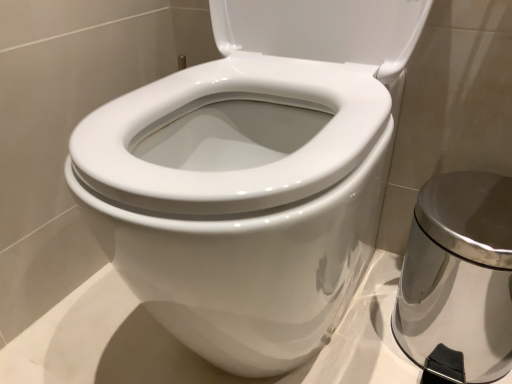
Question: Based on their sizes in the image, would you say white glossy bidet at center is bigger or smaller than satin silver trash can at right?

Choices:
 (A) big
 (B) small

Answer: (A)

Question: Is white glossy bidet at center wider or thinner than satin silver trash can at right?

Choices:
 (A) wide
 (B) thin

Answer: (A)

Question: Is white glossy bidet at center in front of or behind satin silver trash can at right in the image?

Choices:
 (A) front
 (B) behind

Answer: (A)

Question: Is satin silver trash can at right to the left or to the right of white glossy bidet at center in the image?

Choices:
 (A) left
 (B) right

Answer: (B)

Question: Is satin silver trash can at right situated inside white glossy bidet at center or outside?

Choices:
 (A) outside
 (B) inside

Answer: (A)

Question: From a real-world perspective, is satin silver trash can at right above or below white glossy bidet at center?

Choices:
 (A) below
 (B) above

Answer: (A)

Question: Looking at their shapes, would you say satin silver trash can at right is wider or thinner than white glossy bidet at center?

Choices:
 (A) thin
 (B) wide

Answer: (A)